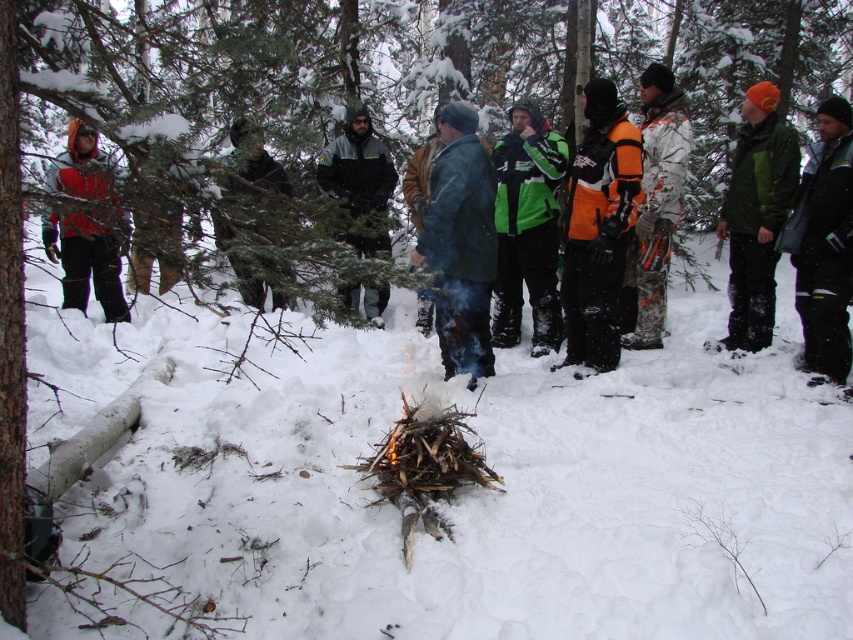
Does blue denim jeans at center appear over dark gray jacket at center?

Incorrect, blue denim jeans at center is not positioned above dark gray jacket at center.

Does blue denim jeans at center have a greater width compared to dark gray jacket at center?

In fact, blue denim jeans at center might be narrower than dark gray jacket at center.

Find the location of `blue denim jeans at center`. blue denim jeans at center is located at coordinates (460, 243).

Identify the location of blue denim jeans at center. The image size is (853, 640). (460, 243).

Which is in front, point (837, 179) or point (364, 189)?

Point (837, 179) is more forward.

At what (x,y) coordinates should I click in order to perform the action: click on orange fleece jacket at right. Please return your answer as a coordinate pair (x, y). The height and width of the screenshot is (640, 853). Looking at the image, I should click on (824, 243).

Who is more distant from viewer, (828, 208) or (352, 205)?

Positioned behind is point (352, 205).

Where is `orange fleece jacket at right`? orange fleece jacket at right is located at coordinates (824, 243).

Between point (459, 115) and point (659, 193), which one is positioned behind?

Point (659, 193)

Based on the photo, how distant is blue denim jeans at center from camouflage jacket at center?

They are 4.72 feet apart.

This screenshot has height=640, width=853. What do you see at coordinates (460, 243) in the screenshot?
I see `blue denim jeans at center` at bounding box center [460, 243].

Identify the location of blue denim jeans at center. This screenshot has width=853, height=640. point(460,243).